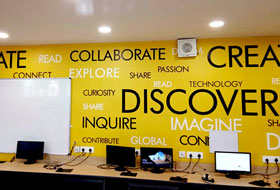
Locate an element on the screen. monitor screen off is located at coordinates (37, 153).